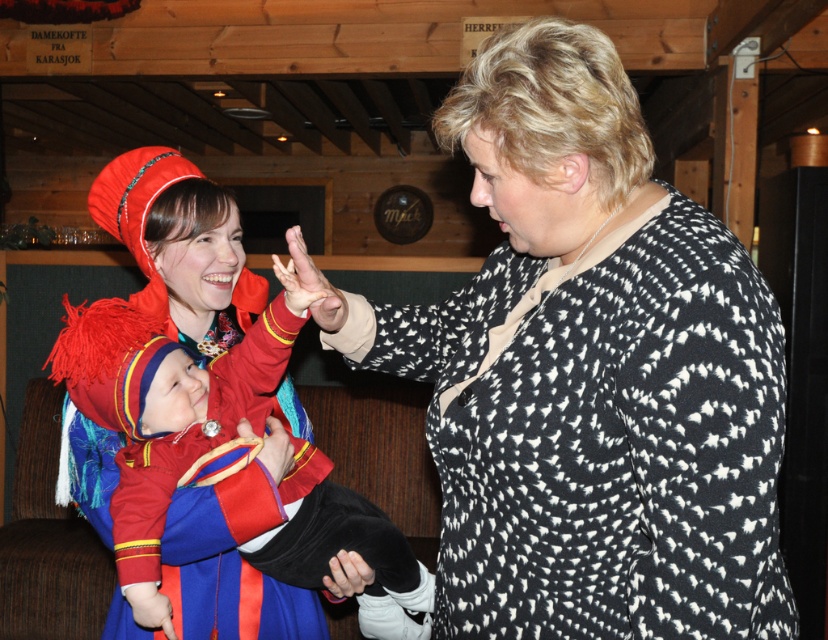
You are standing in the cabin and want to place a small decoration on the point closer to you between point A at point (272, 461) and point B at point (352, 582). Which point should you choose?

You should choose point A at point (272, 461) because it is closer to you than point B at point (352, 582).

You are a photographer trying to capture a closeup of the baby in the scene. The baby is wearing a black dotted sweater at center and a matte red glove at center. Which item is taller when viewed from above?

The black dotted sweater at center has a greater height compared to the matte red glove at center, so the black dotted sweater at center is taller when viewed from above.